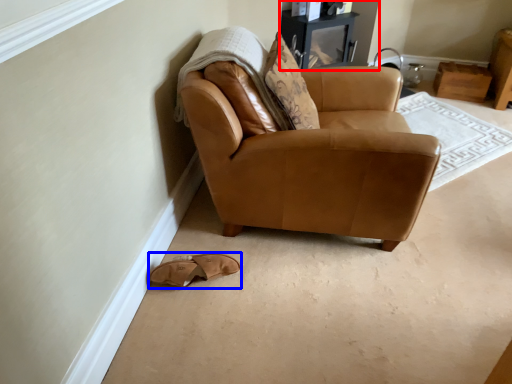
Question: Which of the following is the closest to the observer, entertainment center (highlighted by a red box) or footwear (highlighted by a blue box)?

Choices:
 (A) entertainment center
 (B) footwear

Answer: (B)